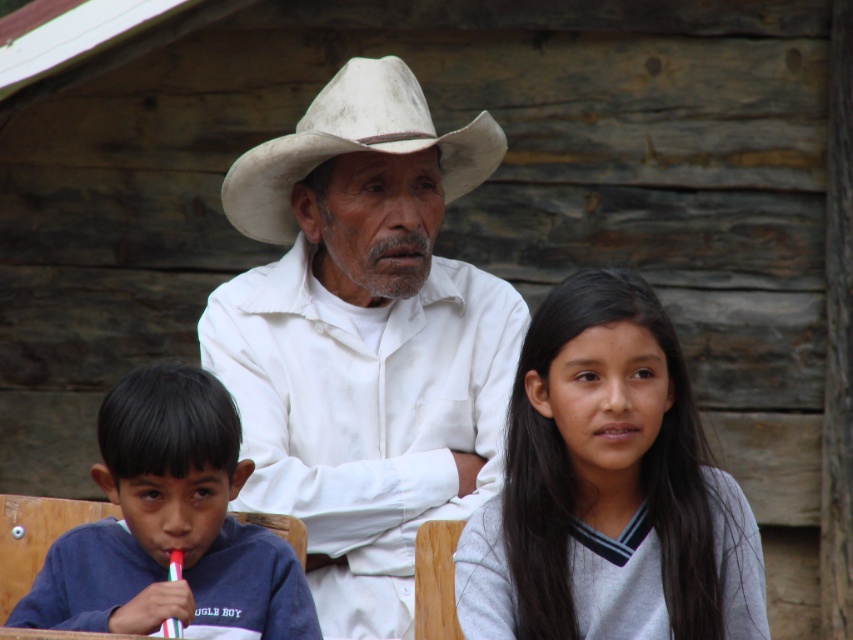
Image resolution: width=853 pixels, height=640 pixels. Find the location of `gray matte sweater at center`. gray matte sweater at center is located at coordinates point(596,504).

Is point (660, 477) behind point (142, 378)?

No, (660, 477) is in front of (142, 378).

Is point (631, 289) farther from viewer compared to point (283, 570)?

No, it is in front of (283, 570).

The height and width of the screenshot is (640, 853). In order to click on gray matte sweater at center in this screenshot , I will do `click(596, 504)`.

Who is more distant from viewer, [283,216] or [125,380]?

Positioned behind is point [283,216].

Image resolution: width=853 pixels, height=640 pixels. What do you see at coordinates (364, 337) in the screenshot? I see `white matte hat at center` at bounding box center [364, 337].

Identify the location of white matte hat at center. The height and width of the screenshot is (640, 853). (364, 337).

Looking at this image, does gray matte sweater at center come in front of white felt cowboy hat at center?

Yes, it is in front of white felt cowboy hat at center.

Does gray matte sweater at center have a lesser width compared to white felt cowboy hat at center?

Indeed, gray matte sweater at center has a lesser width compared to white felt cowboy hat at center.

Does point (589, 604) come behind point (306, 109)?

No, it is not.

Find the location of a particular element. This screenshot has width=853, height=640. gray matte sweater at center is located at coordinates (596, 504).